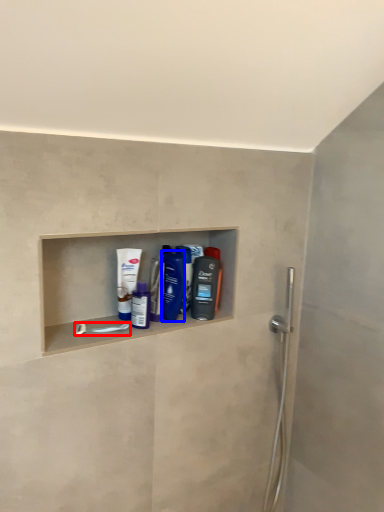
Question: Among these objects, which one is nearest to the camera, towel bar (highlighted by a red box) or mouthwash (highlighted by a blue box)?

Choices:
 (A) towel bar
 (B) mouthwash

Answer: (A)